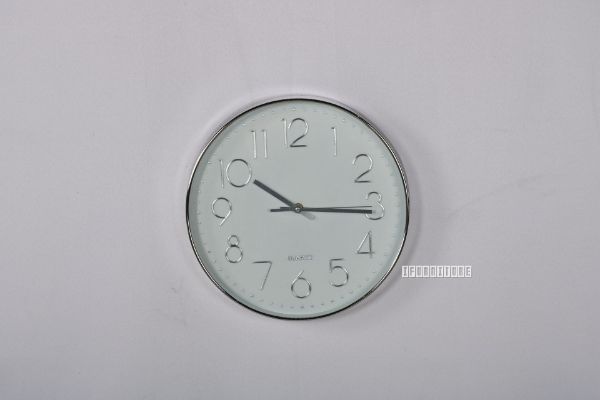
Where is `grey wall`? The image size is (600, 400). grey wall is located at coordinates (434, 53).